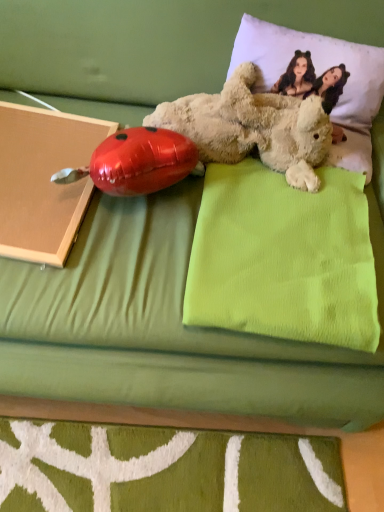
Question: In terms of height, does green fabric pillow at upper center, which is the 2th pillow from top to bottom, look taller or shorter compared to fluffy beige teddy bear at upper right?

Choices:
 (A) tall
 (B) short

Answer: (B)

Question: Choose the correct answer: Is green fabric pillow at upper center, placed as the first pillow when sorted from bottom to top, inside fluffy beige teddy bear at upper right or outside it?

Choices:
 (A) inside
 (B) outside

Answer: (B)

Question: Estimate the real-world distances between objects in this image. Which object is farther from the white soft pillow at upper right, the 1th pillow viewed from the top?

Choices:
 (A) matte cardboard book at left
 (B) green fabric pillow at upper center, which is the 2th pillow from top to bottom
 (C) shiny metallic ladybug at left
 (D) fluffy beige teddy bear at upper right

Answer: (A)

Question: Estimate the real-world distances between objects in this image. Which object is farther from the matte cardboard book at left?

Choices:
 (A) white soft pillow at upper right, the 1th pillow viewed from the top
 (B) fluffy beige teddy bear at upper right
 (C) green fabric pillow at upper center, which is the 2th pillow from top to bottom
 (D) shiny metallic ladybug at left

Answer: (A)